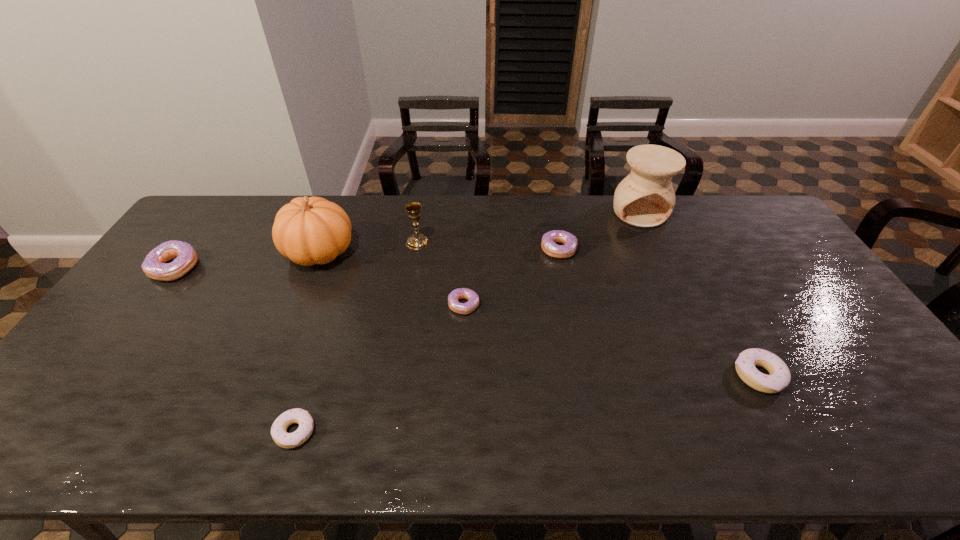
Find the location of a particular element. vacant region between the nearest object and the leftmost doughnut is located at coordinates (235, 349).

Where is `vacant space in between the left white doughnut and the rightmost doughnut`? This screenshot has width=960, height=540. vacant space in between the left white doughnut and the rightmost doughnut is located at coordinates (527, 403).

You are a GUI agent. You are given a task and a screenshot of the screen. Output one action in this format:
    pyautogui.click(x=<x>, y=<y>)
    Task: Click on the free space that is in between the orange pumpkin and the fifth object from right to left
    This screenshot has width=960, height=540.
    Given the screenshot: What is the action you would take?
    pyautogui.click(x=369, y=247)

You are a GUI agent. You are given a task and a screenshot of the screen. Output one action in this format:
    pyautogui.click(x=<x>, y=<y>)
    Task: Click on the vacant space that is in between the nearest purple doughnut and the leftmost doughnut
    
    Given the screenshot: What is the action you would take?
    pyautogui.click(x=320, y=286)

Locate which object is the third closest to the chalice. Please provide its 2D coordinates. Your answer should be formatted as a tuple, i.e. [(x, y)], where the tuple contains the x and y coordinates of a point satisfying the conditions above.

[(549, 239)]

The width and height of the screenshot is (960, 540). Find the location of `object identified as the sixth closest to the orange pumpkin`. object identified as the sixth closest to the orange pumpkin is located at coordinates (645, 198).

Where is `the fourth closest doughnut to the farther white doughnut`? The width and height of the screenshot is (960, 540). the fourth closest doughnut to the farther white doughnut is located at coordinates (155, 266).

Point out which doughnut is positioned as the third nearest to the sixth object from left to right. Please provide its 2D coordinates. Your answer should be formatted as a tuple, i.e. [(x, y)], where the tuple contains the x and y coordinates of a point satisfying the conditions above.

[(279, 433)]

Choose which purple doughnut is the third nearest neighbor to the chalice. Please provide its 2D coordinates. Your answer should be formatted as a tuple, i.e. [(x, y)], where the tuple contains the x and y coordinates of a point satisfying the conditions above.

[(155, 266)]

Select which purple doughnut is the closest to the fourth object from right to left. Please provide its 2D coordinates. Your answer should be formatted as a tuple, i.e. [(x, y)], where the tuple contains the x and y coordinates of a point satisfying the conditions above.

[(549, 239)]